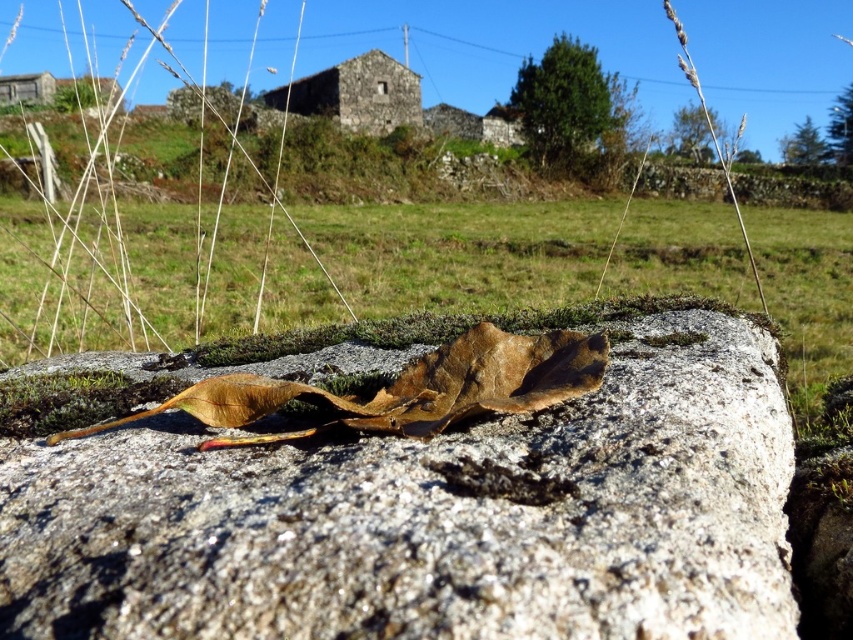
Question: Is granite rock at center closer to the viewer compared to green grass at center?

Choices:
 (A) no
 (B) yes

Answer: (B)

Question: Does granite rock at center appear under green grass at center?

Choices:
 (A) yes
 (B) no

Answer: (A)

Question: Considering the real-world distances, which object is farthest from the brown papery leaf at center?

Choices:
 (A) granite rock at center
 (B) green grass at center

Answer: (B)

Question: Which of the following is the farthest from the observer?

Choices:
 (A) granite rock at center
 (B) green grass at center

Answer: (B)

Question: Which of the following is the closest to the observer?

Choices:
 (A) (515, 518)
 (B) (396, 394)

Answer: (A)

Question: Is green grass at center bigger than brown papery leaf at center?

Choices:
 (A) no
 (B) yes

Answer: (B)